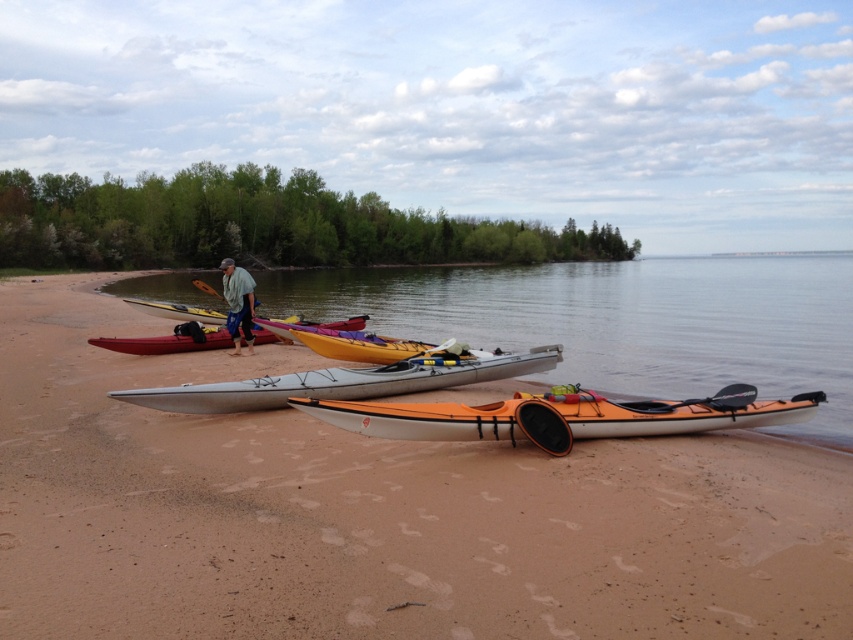
Question: Does silver metallic canoe at center have a lesser width compared to matte pink kayak at center?

Choices:
 (A) no
 (B) yes

Answer: (A)

Question: Which of these objects is positioned closest to the yellow matte kayak at center?

Choices:
 (A) matte yellow kayak at center
 (B) silver metallic canoe at center
 (C) green cotton shirt at center
 (D) orange matte kayak at center

Answer: (B)

Question: Is smooth brown sand at center bigger than green cotton shirt at center?

Choices:
 (A) no
 (B) yes

Answer: (B)

Question: Is smooth brown sand at center bigger than matte yellow kayak at center?

Choices:
 (A) no
 (B) yes

Answer: (B)

Question: Which is farther from the matte pink kayak at center?

Choices:
 (A) matte red kayak at center
 (B) orange matte kayak at center

Answer: (B)

Question: Which point is farther to the camera?

Choices:
 (A) (244, 394)
 (B) (363, 314)
 (C) (252, 289)
 (D) (810, 344)

Answer: (D)